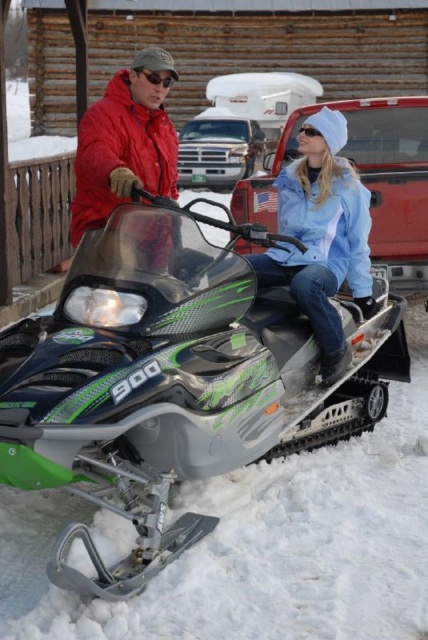
Question: Which of the following is the closest to the observer?

Choices:
 (A) (133, 458)
 (B) (314, 129)
 (C) (112, 195)

Answer: (A)

Question: Which of these objects is positioned closest to the black matte goggles at upper center?

Choices:
 (A) clear plastic goggles at upper center
 (B) light blue denim jacket at center
 (C) green matte snowmobile at center

Answer: (A)

Question: Which point is farther to the camera?

Choices:
 (A) (157, 77)
 (B) (80, 196)
 (C) (235, 401)

Answer: (B)

Question: Does light blue denim jacket at center have a larger size compared to black matte goggles at upper center?

Choices:
 (A) yes
 (B) no

Answer: (A)

Question: Does light blue denim jacket at center appear under clear plastic goggles at upper center?

Choices:
 (A) yes
 (B) no

Answer: (A)

Question: Is light blue denim jacket at center to the left of black matte goggles at upper center from the viewer's perspective?

Choices:
 (A) yes
 (B) no

Answer: (B)